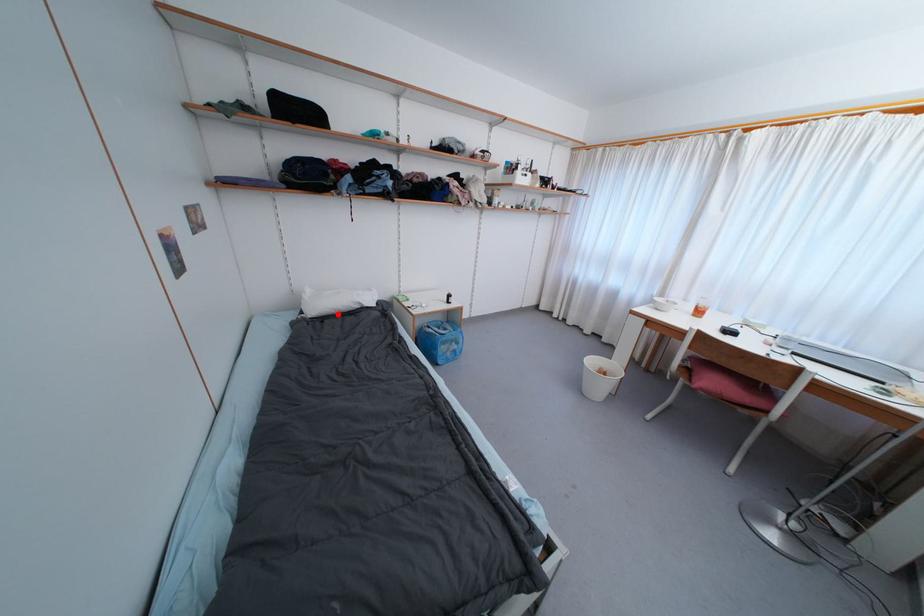
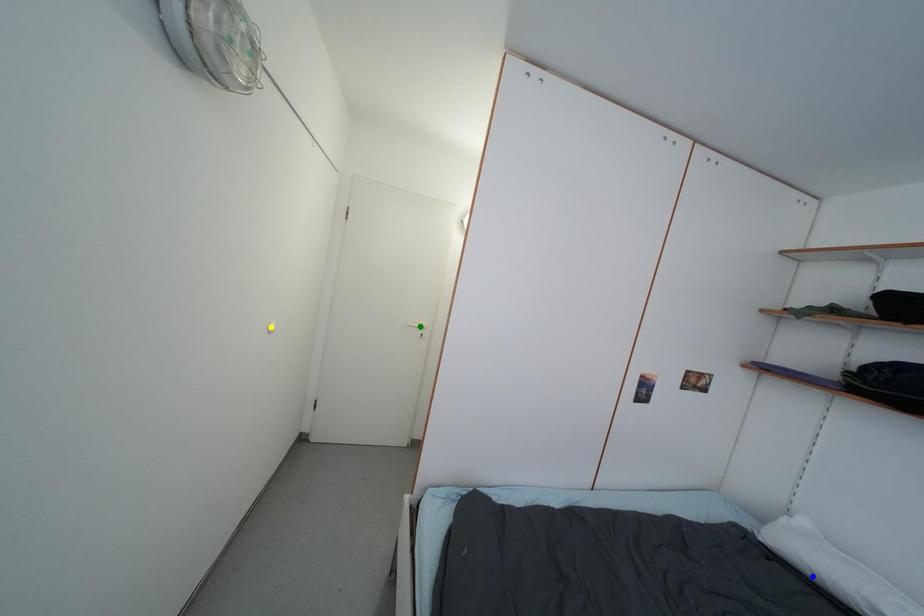
Question: I am providing you with two images of the same scene from different viewpoints. A red point is marked on the first image. You are given multiple points on the second image. Which point in image 2 represents the same 3d spot as the red point in image 1?

Choices:
 (A) yellow point
 (B) green point
 (C) blue point

Answer: (C)